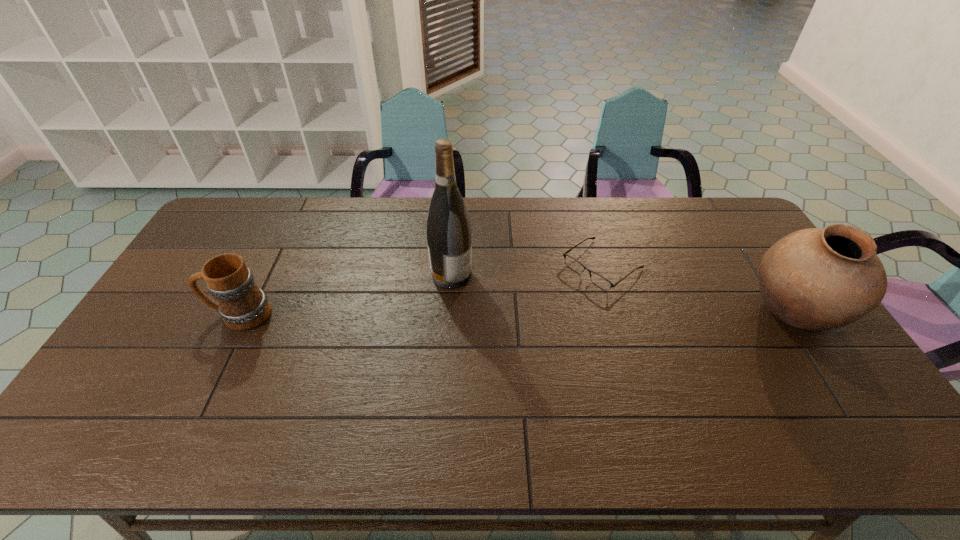
I want to click on vacant point located between the leftmost object and the tallest object, so click(x=346, y=295).

Locate an element on the screen. The image size is (960, 540). free spot between the pottery and the second object from right to left is located at coordinates (697, 289).

Locate an element on the screen. This screenshot has height=540, width=960. empty space that is in between the spectacles and the rightmost object is located at coordinates (697, 289).

In order to click on unoccupied area between the third shortest object and the leftmost object in this screenshot , I will do `click(516, 314)`.

This screenshot has width=960, height=540. Identify the location of empty location between the shortest object and the wine bottle. (527, 271).

You are a GUI agent. You are given a task and a screenshot of the screen. Output one action in this format:
    pyautogui.click(x=<x>, y=<y>)
    Task: Click on the vacant space that's between the mug and the third shortest object
    
    Given the screenshot: What is the action you would take?
    pyautogui.click(x=516, y=314)

Find the location of a particular element. The height and width of the screenshot is (540, 960). object that stands as the third closest to the shortest object is located at coordinates (243, 306).

Identify the location of the second closest object relative to the third tallest object. This screenshot has height=540, width=960. (600, 281).

Identify the location of free space that satisfies the following two spatial constraints: 1. on the back side of the wine bottle; 2. on the left side of the second object from right to left. This screenshot has width=960, height=540. (452, 266).

Where is `free space that satisfies the following two spatial constraints: 1. on the front side of the pottery; 2. on the right side of the shortest object`? Image resolution: width=960 pixels, height=540 pixels. free space that satisfies the following two spatial constraints: 1. on the front side of the pottery; 2. on the right side of the shortest object is located at coordinates (615, 313).